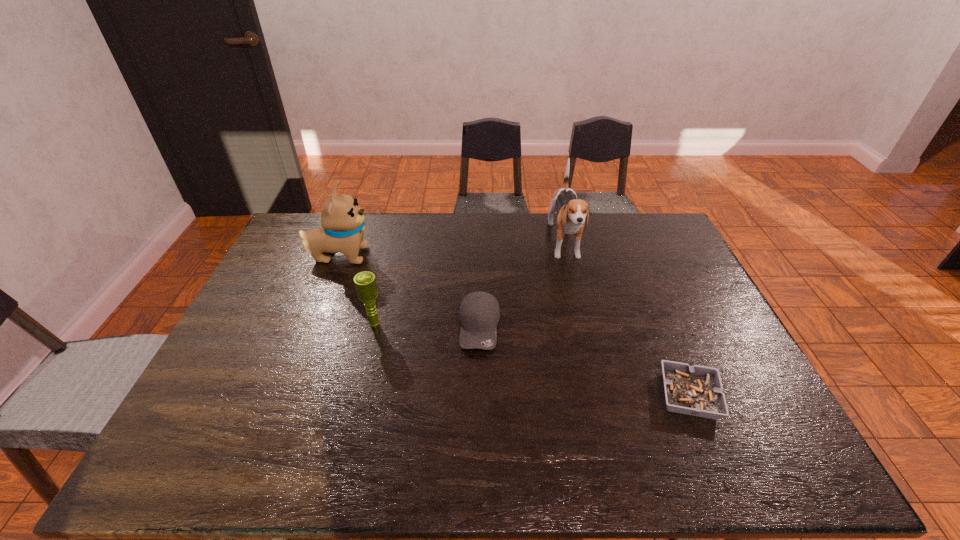
You are a GUI agent. You are given a task and a screenshot of the screen. Output one action in this format:
    pyautogui.click(x=<x>, y=<y>)
    Task: Click on the free point between the baseball cap and the leftmost object
    
    Given the screenshot: What is the action you would take?
    pyautogui.click(x=410, y=291)

You are a GUI agent. You are given a task and a screenshot of the screen. Output one action in this format:
    pyautogui.click(x=<x>, y=<y>)
    Task: Click on the free space between the fourth tallest object and the right puppy
    
    Given the screenshot: What is the action you would take?
    pyautogui.click(x=522, y=286)

The height and width of the screenshot is (540, 960). What are the coordinates of `vacant point located between the right puppy and the left puppy` in the screenshot? It's located at (452, 250).

Identify the location of vacant point located between the shortest object and the right puppy. (627, 320).

The image size is (960, 540). What are the coordinates of `vacant area that lies between the second object from right to left and the fourth object from right to left` in the screenshot? It's located at (469, 284).

What are the coordinates of `empty space between the baseball cap and the fourth object from right to left` in the screenshot? It's located at (427, 326).

What are the coordinates of `free space that is in between the fourth object from left to right and the leftmost object` in the screenshot? It's located at (452, 250).

I want to click on vacant area that lies between the third object from left to right and the second object from left to right, so click(427, 326).

Where is `free space that is in between the shortest object and the microphone`? Image resolution: width=960 pixels, height=540 pixels. free space that is in between the shortest object and the microphone is located at coordinates (532, 360).

Locate an element on the screen. object that can be found as the fourth closest to the baseball cap is located at coordinates click(x=696, y=390).